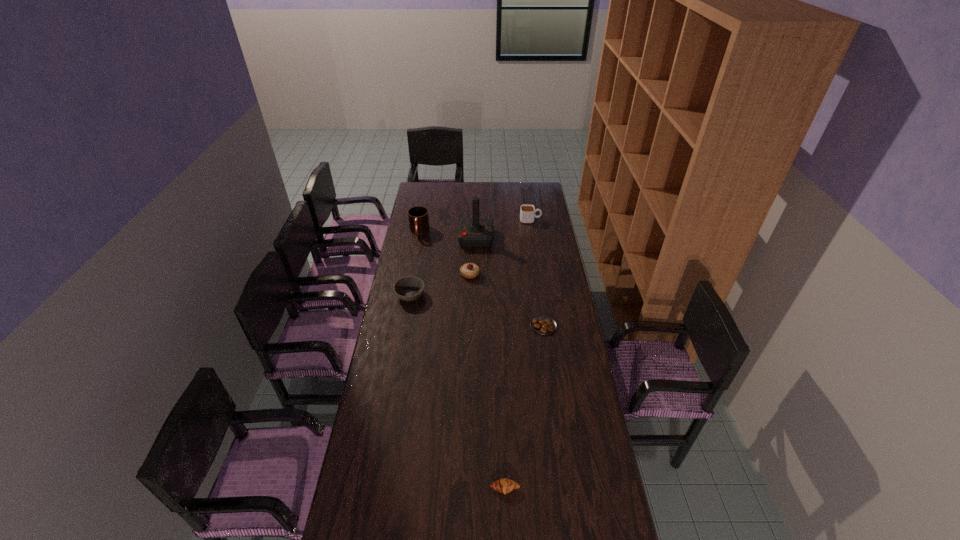
In order to click on the tallest object in this screenshot , I will do `click(473, 232)`.

You are a GUI agent. You are given a task and a screenshot of the screen. Output one action in this format:
    pyautogui.click(x=<x>, y=<y>)
    Task: Click on the second tallest object
    The image size is (960, 540).
    Given the screenshot: What is the action you would take?
    pyautogui.click(x=418, y=218)

Locate an element on the screen. This screenshot has width=960, height=540. cup is located at coordinates (527, 211).

The image size is (960, 540). Find the location of `the fourth nearest object`. the fourth nearest object is located at coordinates (469, 270).

The image size is (960, 540). What are the coordinates of `the fourth shortest object` in the screenshot? It's located at (469, 270).

Identify the location of bowl. The width and height of the screenshot is (960, 540). (410, 288).

At what (x,y) coordinates should I click in order to perform the action: click on the third nearest object. Please return your answer as a coordinate pair (x, y). The width and height of the screenshot is (960, 540). Looking at the image, I should click on coord(410,288).

The height and width of the screenshot is (540, 960). Identify the location of the second tallest pastry. (505, 485).

Where is `the nearest pastry`? The width and height of the screenshot is (960, 540). the nearest pastry is located at coordinates (505, 485).

You are a GUI agent. You are given a task and a screenshot of the screen. Output one action in this format:
    pyautogui.click(x=<x>, y=<y>)
    Task: Click on the sixth farthest object
    Image resolution: width=960 pixels, height=540 pixels.
    Given the screenshot: What is the action you would take?
    pyautogui.click(x=541, y=324)